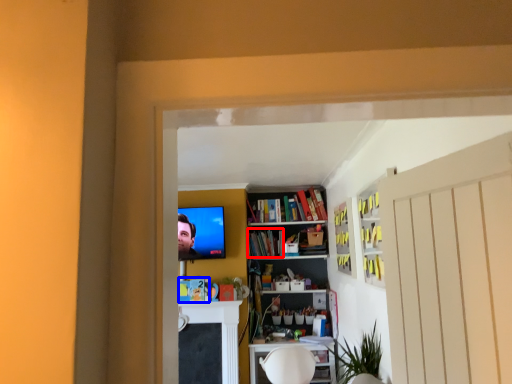
Question: Which point is closer to the camera, book (highlighted by a red box) or book (highlighted by a blue box)?

Choices:
 (A) book
 (B) book

Answer: (B)